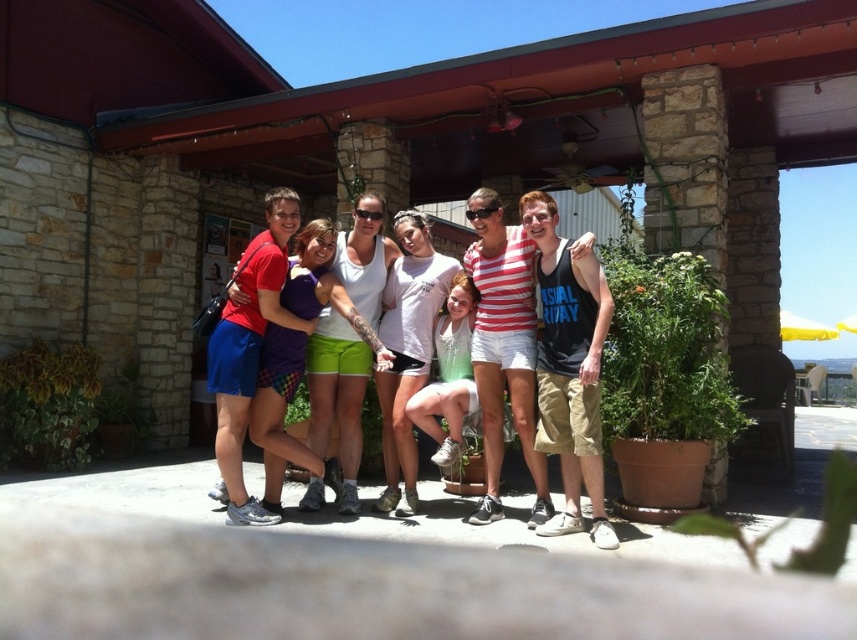
Can you confirm if striped cotton shirt at center is positioned to the right of white cotton shirt at center?

Indeed, striped cotton shirt at center is positioned on the right side of white cotton shirt at center.

Which is above, striped cotton shirt at center or white cotton shirt at center?

striped cotton shirt at center

The height and width of the screenshot is (640, 857). What do you see at coordinates (504, 346) in the screenshot? I see `striped cotton shirt at center` at bounding box center [504, 346].

The width and height of the screenshot is (857, 640). In order to click on striped cotton shirt at center in this screenshot , I will do (504, 346).

Does plaid shorts at center lie behind white cotton t-shirt at center?

No, it is in front of white cotton t-shirt at center.

What do you see at coordinates (280, 413) in the screenshot? This screenshot has height=640, width=857. I see `plaid shorts at center` at bounding box center [280, 413].

Find the location of a particular element. plaid shorts at center is located at coordinates (280, 413).

Locate an element on the screen. This screenshot has width=857, height=640. plaid shorts at center is located at coordinates (280, 413).

Who is shorter, plaid shorts at center or white cotton shirt at center?

white cotton shirt at center

Does plaid shorts at center have a greater height compared to white cotton shirt at center?

Yes.

Does point (274, 472) come behind point (463, 385)?

Yes, point (274, 472) is farther from viewer.

Identify the location of plaid shorts at center. (280, 413).